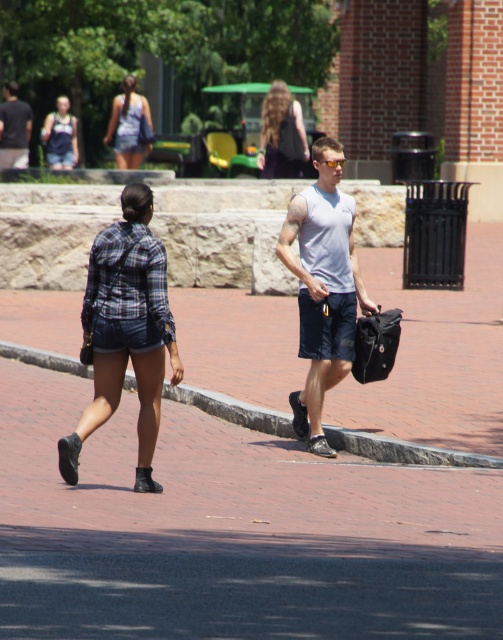
Question: Is plaid cotton shorts at center positioned at the back of brick at lower center?

Choices:
 (A) no
 (B) yes

Answer: (A)

Question: Is plaid fabric shirt at upper center smaller than matte gray tank top at upper left?

Choices:
 (A) no
 (B) yes

Answer: (B)

Question: Estimate the real-world distances between objects in this image. Which object is closer to the matte blue shorts at upper left?

Choices:
 (A) matte black backpack at upper center
 (B) matte gray tank top at upper left
 (C) brick at lower center

Answer: (B)

Question: Which object is farther from the camera taking this photo?

Choices:
 (A) matte gray tank top at upper left
 (B) plaid fabric shirt at upper center
 (C) brick at lower center

Answer: (B)

Question: Does plaid fabric shirt at upper center appear on the left side of matte blue shorts at upper left?

Choices:
 (A) yes
 (B) no

Answer: (B)

Question: Which point appears closest to the camera in this image?

Choices:
 (A) (70, 129)
 (B) (132, 256)
 (C) (23, 120)

Answer: (B)